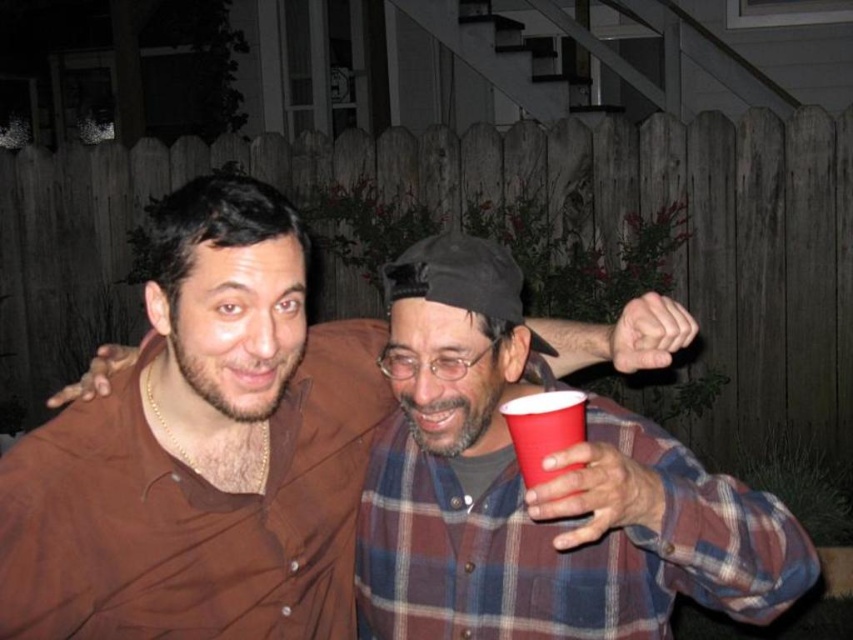
Can you confirm if matte brown shirt at center is smaller than matte plastic cup at lower right?

No, matte brown shirt at center is not smaller than matte plastic cup at lower right.

Which is above, matte brown shirt at center or matte plastic cup at lower right?

matte plastic cup at lower right

Measure the distance between point (228, 337) and camera.

A distance of 1.04 meters exists between point (228, 337) and camera.

Identify the location of matte brown shirt at center. (202, 449).

Looking at this image, is matte brown shirt at center wider than plaid fabric at center?

No, matte brown shirt at center is not wider than plaid fabric at center.

What do you see at coordinates (202, 449) in the screenshot? The width and height of the screenshot is (853, 640). I see `matte brown shirt at center` at bounding box center [202, 449].

This screenshot has width=853, height=640. In order to click on matte brown shirt at center in this screenshot , I will do `click(202, 449)`.

Who is positioned more to the right, plaid fabric at center or matte plastic cup at lower right?

Positioned to the right is matte plastic cup at lower right.

I want to click on plaid fabric at center, so click(538, 490).

What do you see at coordinates (538, 490) in the screenshot? I see `plaid fabric at center` at bounding box center [538, 490].

The height and width of the screenshot is (640, 853). Identify the location of plaid fabric at center. (538, 490).